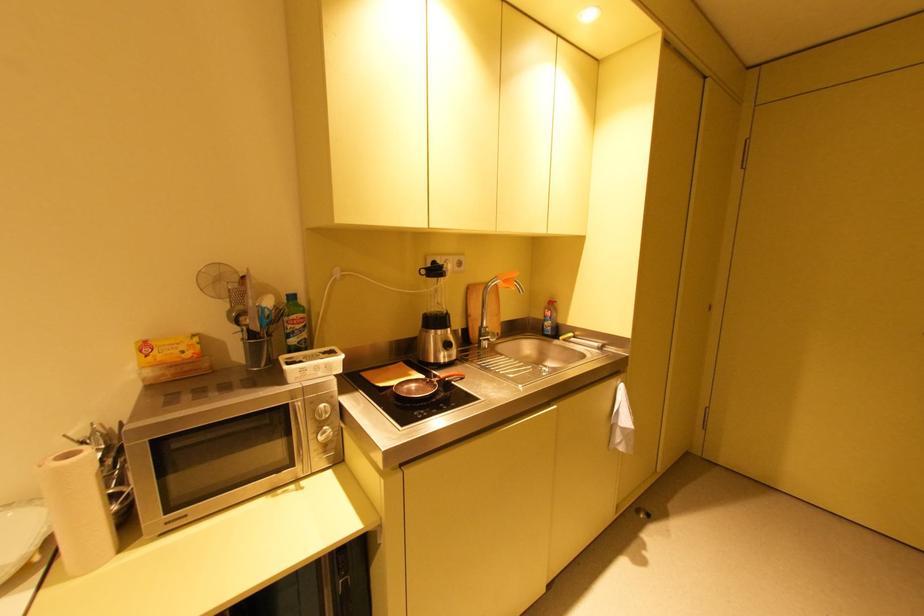
At what (x,y) coordinates should I click in order to perform the action: click on white container lid. Please return your answer as a coordinate pair (x, y). Image resolution: width=924 pixels, height=616 pixels. Looking at the image, I should click on (20, 533).